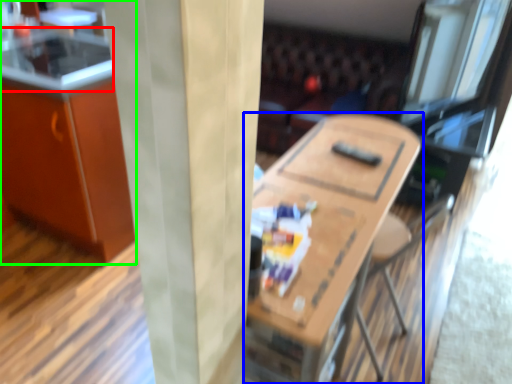
Question: Which object is positioned closest to counter top (highlighted by a red box)? Select from table (highlighted by a blue box) and cabinetry (highlighted by a green box).

Choices:
 (A) table
 (B) cabinetry

Answer: (B)